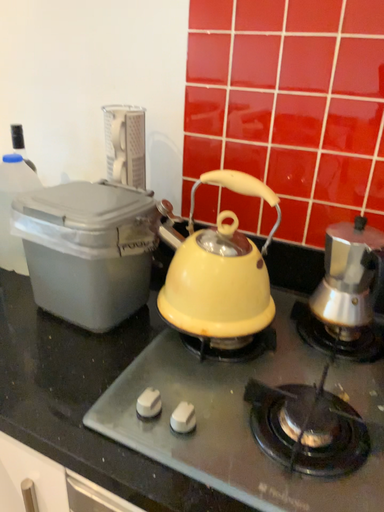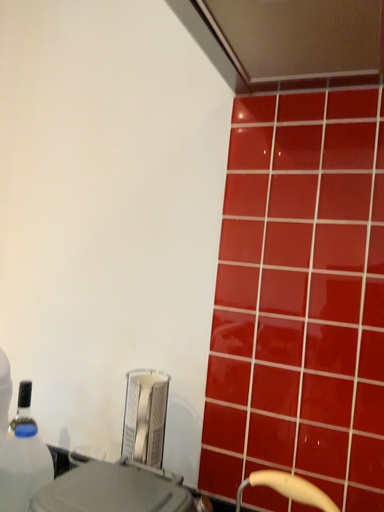
Question: How did the camera likely rotate when shooting the video?

Choices:
 (A) rotated upward
 (B) rotated downward

Answer: (A)